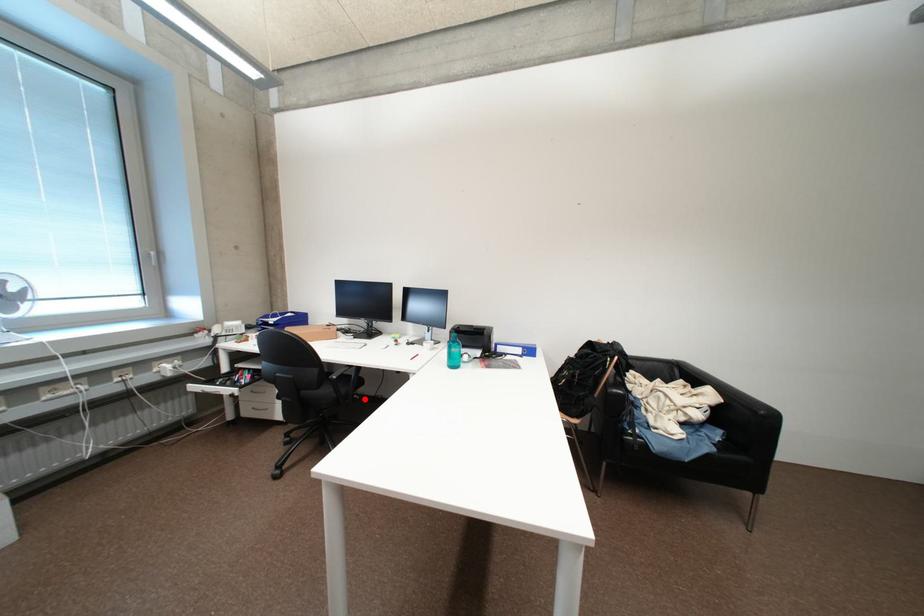
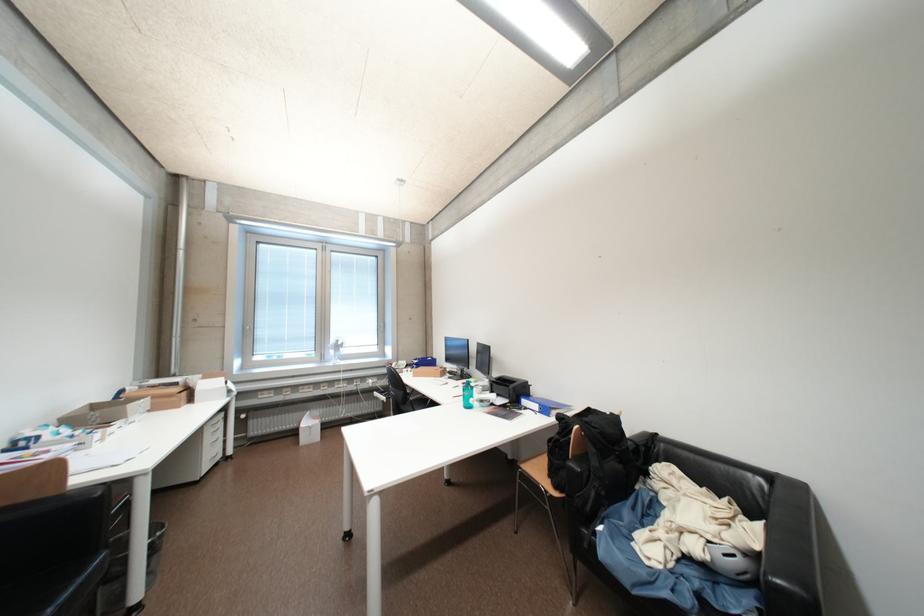
Question: I am providing you with two images of the same scene from different viewpoints. A red point is marked on the first image. Is the red point's position out of view in image 2?

Choices:
 (A) Yes
 (B) No

Answer: (A)